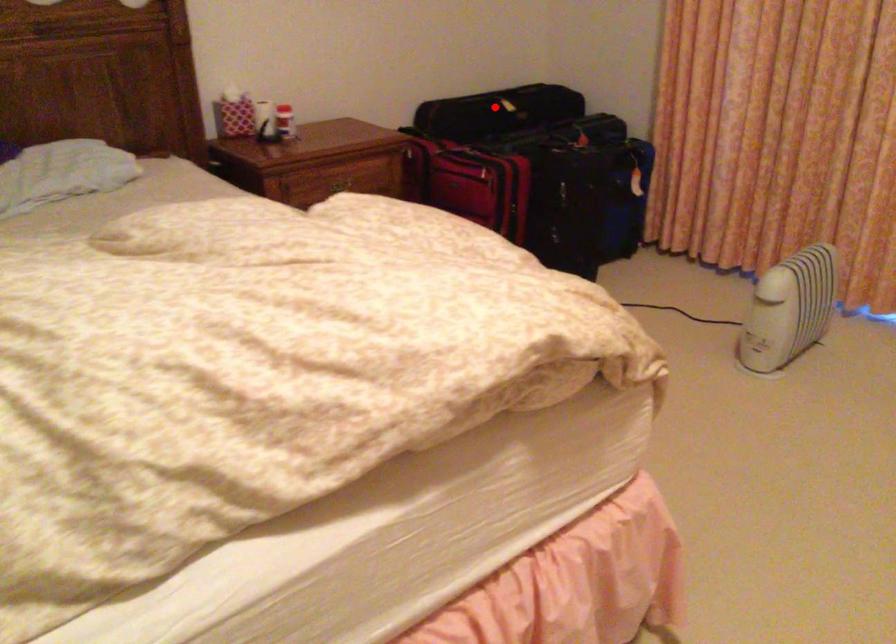
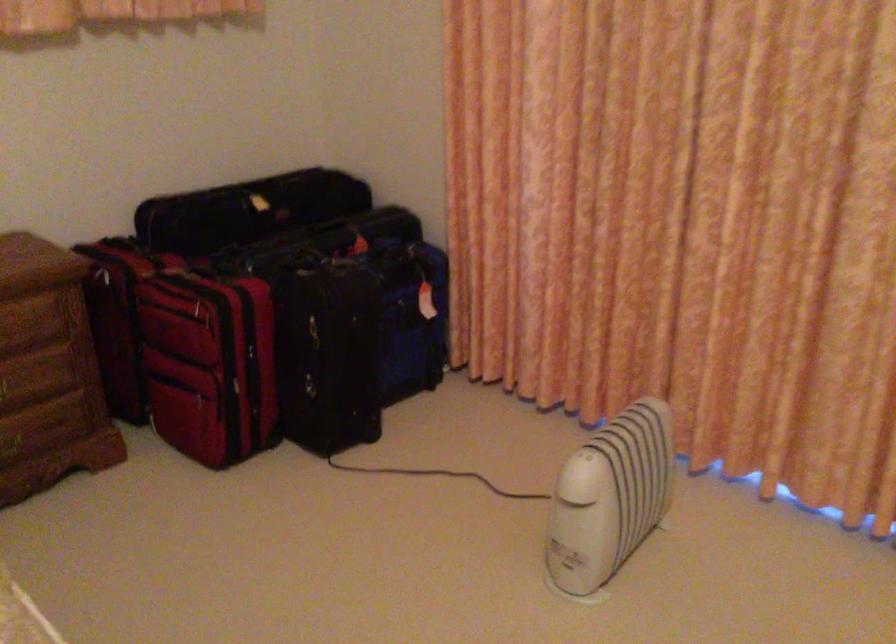
Find the pixel in the second image that matches the highlighted location in the first image.

(247, 210)